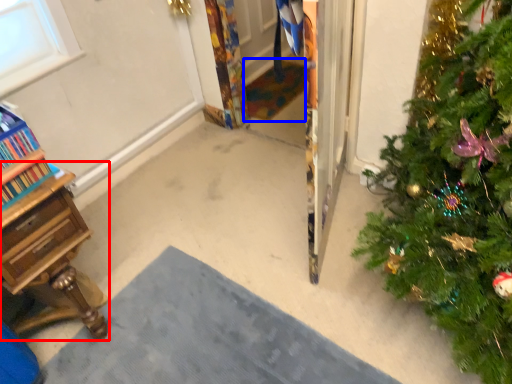
Question: Among these objects, which one is farthest to the camera, desk (highlighted by a red box) or doormat (highlighted by a blue box)?

Choices:
 (A) desk
 (B) doormat

Answer: (B)